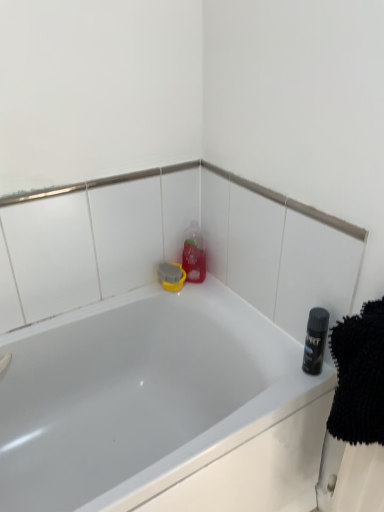
In order to click on vacant area that lies between shiny black can at right and translucent plastic bottle at upper center in this screenshot , I will do `click(244, 321)`.